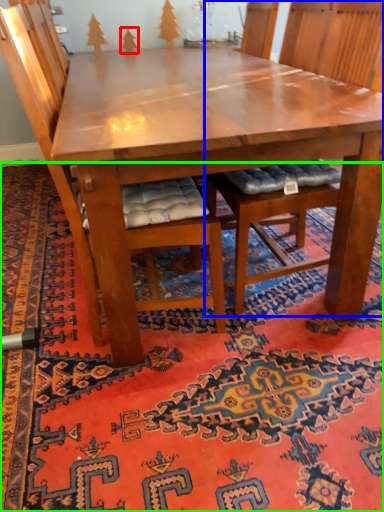
Question: Based on their relative distances, which object is farther from tree (highlighted by a red box)? Choose from chair (highlighted by a blue box) and mat (highlighted by a green box).

Choices:
 (A) chair
 (B) mat

Answer: (B)